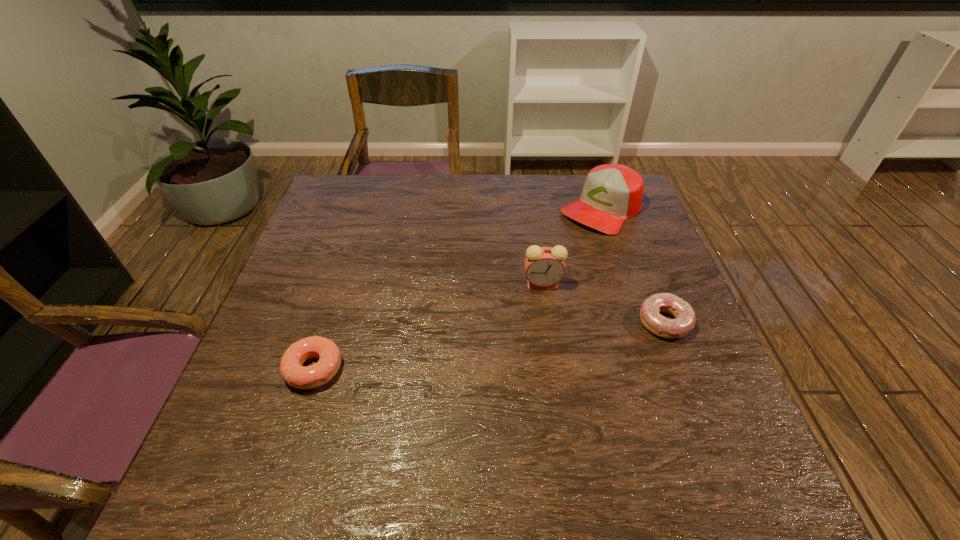
The width and height of the screenshot is (960, 540). Find the location of `free spot at the far edge of the desktop`. free spot at the far edge of the desktop is located at coordinates (539, 184).

Find the location of a particular element. Image resolution: width=960 pixels, height=540 pixels. vacant space at the near edge of the desktop is located at coordinates (398, 419).

In the image, there is a desktop. Where is `vacant space at the left edge`? The width and height of the screenshot is (960, 540). vacant space at the left edge is located at coordinates (331, 237).

Identify the location of vacant space at the right edge. 659,285.

Where is `free spot at the far left corner of the desktop`? free spot at the far left corner of the desktop is located at coordinates (358, 218).

The image size is (960, 540). I want to click on vacant space at the near right corner of the desktop, so click(684, 429).

The width and height of the screenshot is (960, 540). Identify the location of free area in between the nearest object and the farthest object. (458, 289).

The height and width of the screenshot is (540, 960). I want to click on free space between the leftmost object and the farthest object, so click(458, 289).

Locate an element on the screen. vacant area between the third nearest object and the right doughnut is located at coordinates (604, 302).

Locate an element on the screen. vacant area between the farthest object and the right doughnut is located at coordinates (634, 266).